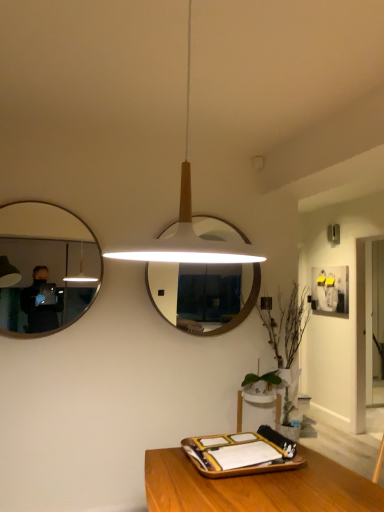
Question: Could you tell me if white wooden mirror at center, marked as the 2th mirror in a left-to-right arrangement, is facing green leafy plant at lower right?

Choices:
 (A) no
 (B) yes

Answer: (A)

Question: From the image's perspective, is white wooden mirror at center, marked as the 2th mirror in a left-to-right arrangement, under green leafy plant at lower right?

Choices:
 (A) no
 (B) yes

Answer: (A)

Question: Does white wooden mirror at center, marked as the 2th mirror in a left-to-right arrangement, have a lesser width compared to green leafy plant at lower right?

Choices:
 (A) yes
 (B) no

Answer: (A)

Question: Is white wooden mirror at center, marked as the 2th mirror in a left-to-right arrangement, placed right next to green leafy plant at lower right?

Choices:
 (A) no
 (B) yes

Answer: (A)

Question: From the image's perspective, would you say white wooden mirror at center, which is the 1th mirror from back to front, is positioned over green leafy plant at lower right?

Choices:
 (A) yes
 (B) no

Answer: (A)

Question: Would you consider white wooden mirror at center, which is the 1th mirror from back to front, to be distant from green leafy plant at lower right?

Choices:
 (A) yes
 (B) no

Answer: (B)

Question: Is white wooden mirror at center, which is the 1th mirror from back to front, bigger than white matte pendant light at center?

Choices:
 (A) yes
 (B) no

Answer: (B)

Question: From the image's perspective, is white wooden mirror at center, which is the first mirror in right-to-left order, beneath white matte pendant light at center?

Choices:
 (A) no
 (B) yes

Answer: (B)

Question: Can you confirm if white wooden mirror at center, which is the 1th mirror from back to front, is smaller than white matte pendant light at center?

Choices:
 (A) no
 (B) yes

Answer: (B)

Question: Could you tell me if white wooden mirror at center, which is the 1th mirror from back to front, is turned towards white matte pendant light at center?

Choices:
 (A) yes
 (B) no

Answer: (A)

Question: Does white wooden mirror at center, which is the 1th mirror from back to front, appear on the right side of white matte pendant light at center?

Choices:
 (A) yes
 (B) no

Answer: (A)

Question: Is white wooden mirror at center, which is the 1th mirror from back to front, positioned before white matte pendant light at center?

Choices:
 (A) yes
 (B) no

Answer: (B)

Question: Is the depth of matte black mirror at left, which is counted as the second mirror, starting from the back, less than that of green leafy plant at lower right?

Choices:
 (A) yes
 (B) no

Answer: (A)